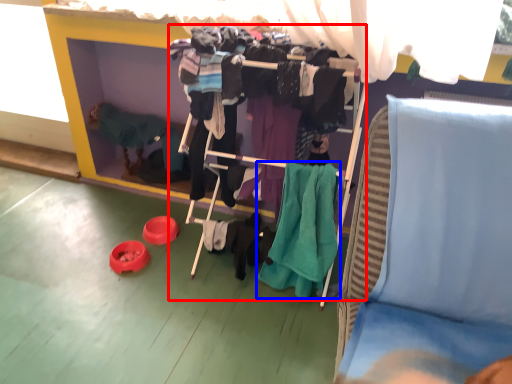
Question: Which point is further to the camera, closet (highlighted by a red box) or clothing (highlighted by a blue box)?

Choices:
 (A) closet
 (B) clothing

Answer: (B)